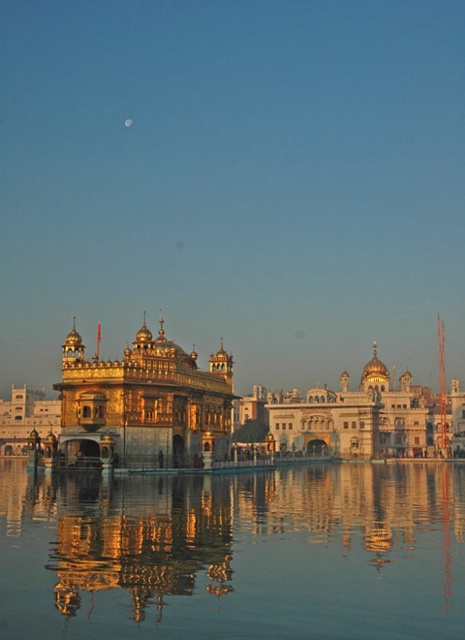
Question: Which object appears farthest from the camera in this image?

Choices:
 (A) gold reflective water at center
 (B) golden polished temple at center
 (C) silvery reflective moon at upper center

Answer: (C)

Question: Which object appears closest to the camera in this image?

Choices:
 (A) gold reflective water at center
 (B) transparent glass water at center
 (C) golden polished temple at center
 (D) silvery reflective moon at upper center

Answer: (B)

Question: Is the position of gold reflective water at center more distant than that of silvery reflective moon at upper center?

Choices:
 (A) yes
 (B) no

Answer: (B)

Question: Is golden polished temple at center further to the viewer compared to silvery reflective moon at upper center?

Choices:
 (A) yes
 (B) no

Answer: (B)

Question: Is gold reflective water at center positioned at the back of golden polished temple at center?

Choices:
 (A) no
 (B) yes

Answer: (A)

Question: Estimate the real-world distances between objects in this image. Which object is closer to the gold reflective water at center?

Choices:
 (A) golden polished temple at center
 (B) silvery reflective moon at upper center

Answer: (A)